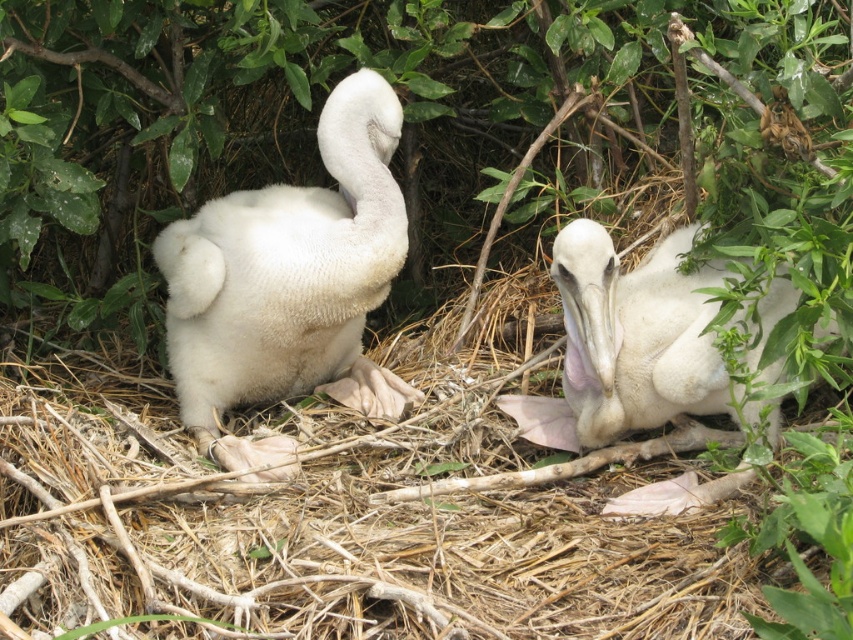
Between white fluffy bird at left and white fluffy bird at center, which one appears on the right side from the viewer's perspective?

white fluffy bird at center is more to the right.

Is white fluffy bird at left thinner than white fluffy bird at center?

In fact, white fluffy bird at left might be wider than white fluffy bird at center.

Who is more forward, (271,317) or (692,392)?

Point (692,392) is more forward.

Find the location of `white fluffy bird at left`. white fluffy bird at left is located at coordinates (289, 282).